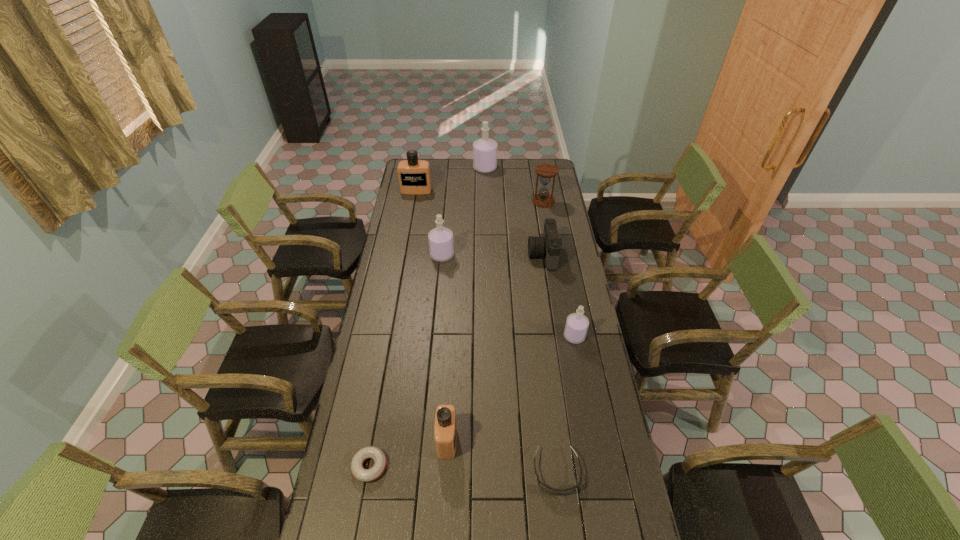
Image resolution: width=960 pixels, height=540 pixels. What are the coordinates of `vacant space located on the front of the sixth farthest object` in the screenshot? It's located at (586, 397).

What are the coordinates of `free location located 0.230m at the lens of the third shortest object` in the screenshot? It's located at (481, 255).

Where is `free spot located 0.340m at the lens of the third shortest object`? free spot located 0.340m at the lens of the third shortest object is located at coordinates (x=458, y=255).

The width and height of the screenshot is (960, 540). In order to click on free spot located 0.330m at the lens of the third shortest object in this screenshot , I will do click(460, 255).

You are a GUI agent. You are given a task and a screenshot of the screen. Output one action in this format:
    pyautogui.click(x=<x>, y=<y>)
    Task: Click on the vacant region located on the lenses of the black goggles
    
    Given the screenshot: What is the action you would take?
    pyautogui.click(x=563, y=519)

Identify the location of free location located on the back of the doughnut. (378, 416).

This screenshot has width=960, height=540. Find the location of `object situated at the far edge`. object situated at the far edge is located at coordinates (485, 149).

Image resolution: width=960 pixels, height=540 pixels. In order to click on perfume that is at the left edge in this screenshot , I will do (x=414, y=177).

Identify the location of doughnut located at the left edge. The width and height of the screenshot is (960, 540). (365, 475).

In order to click on hourglass present at the right edge in this screenshot , I will do `click(546, 171)`.